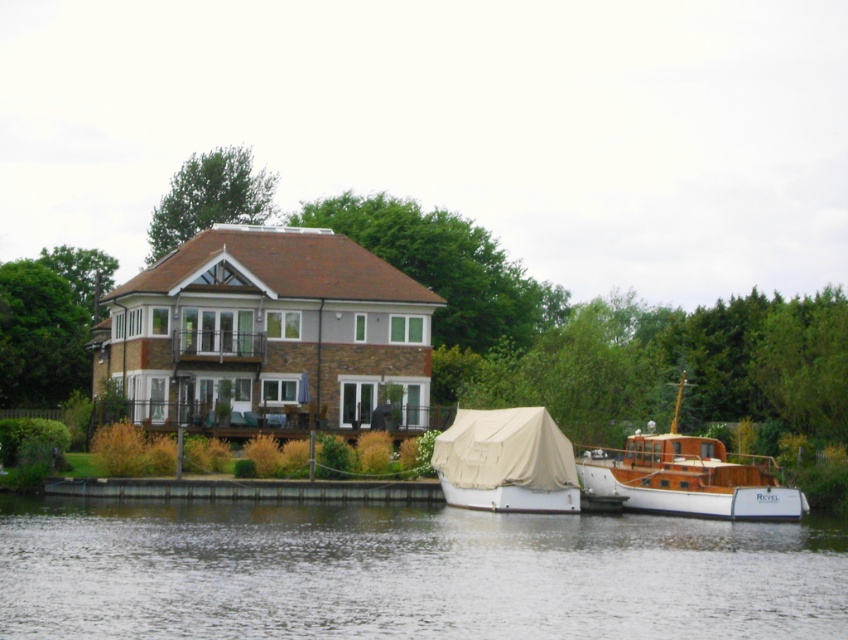
Question: Which object is positioned closest to the beige canvas boat at lower center?

Choices:
 (A) wooden boat at right
 (B) transparent water at lower center

Answer: (A)

Question: Which object is positioned farthest from the beige canvas boat at lower center?

Choices:
 (A) transparent water at lower center
 (B) wooden boat at right

Answer: (A)

Question: From the image, what is the correct spatial relationship of transparent water at lower center in relation to wooden boat at right?

Choices:
 (A) right
 (B) left

Answer: (B)

Question: Estimate the real-world distances between objects in this image. Which object is farther from the transparent water at lower center?

Choices:
 (A) beige canvas boat at lower center
 (B) wooden boat at right

Answer: (B)

Question: Is transparent water at lower center above wooden boat at right?

Choices:
 (A) no
 (B) yes

Answer: (A)

Question: Does transparent water at lower center have a greater width compared to wooden boat at right?

Choices:
 (A) no
 (B) yes

Answer: (B)